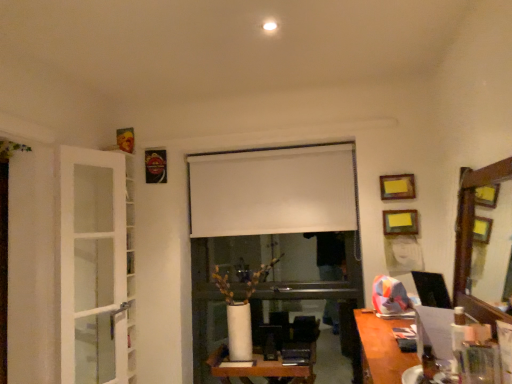
This screenshot has height=384, width=512. What do you see at coordinates (400, 222) in the screenshot?
I see `yellow paper at upper right, arranged as the first picture frame when ordered from the bottom` at bounding box center [400, 222].

The image size is (512, 384). What do you see at coordinates (397, 187) in the screenshot?
I see `wooden picture frame at upper right, the 2th picture frame when ordered from right to left` at bounding box center [397, 187].

This screenshot has height=384, width=512. Describe the element at coordinates (155, 166) in the screenshot. I see `metallic gold picture frame at upper left, the third picture frame from the bottom` at that location.

Measure the distance between point (x=479, y=308) and camera.

Point (x=479, y=308) and camera are 1.79 meters apart from each other.

Where is `yellow paper at upper right, which appears as the 3th picture frame when viewed from the left`? Image resolution: width=512 pixels, height=384 pixels. yellow paper at upper right, which appears as the 3th picture frame when viewed from the left is located at coordinates (400, 222).

Between white glossy table at center, the 1th table viewed from the back, and metallic gold picture frame at upper left, acting as the first picture frame starting from the left, which one appears on the right side from the viewer's perspective?

From the viewer's perspective, white glossy table at center, the 1th table viewed from the back, appears more on the right side.

From the picture: Is white glossy table at center, the second table from the top, in contact with metallic gold picture frame at upper left, which is counted as the third picture frame, starting from the front?

There is a gap between white glossy table at center, the second table from the top, and metallic gold picture frame at upper left, which is counted as the third picture frame, starting from the front.

Is white glossy table at center, placed as the first table when sorted from left to right, oriented towards metallic gold picture frame at upper left, the third picture frame from the bottom?

No, white glossy table at center, placed as the first table when sorted from left to right, is not facing towards metallic gold picture frame at upper left, the third picture frame from the bottom.

Is point (287, 377) closer or farther from the camera than point (152, 178)?

Point (287, 377) appears to be closer to the viewer than point (152, 178).

Considering the relative sizes of wooden framed mirror at right and metallic gold picture frame at upper left, placed as the first picture frame when sorted from top to bottom, in the image provided, is wooden framed mirror at right wider than metallic gold picture frame at upper left, placed as the first picture frame when sorted from top to bottom,?

Yes, wooden framed mirror at right is wider than metallic gold picture frame at upper left, placed as the first picture frame when sorted from top to bottom.

Is wooden framed mirror at right far away from metallic gold picture frame at upper left, acting as the first picture frame starting from the left?

Yes, wooden framed mirror at right and metallic gold picture frame at upper left, acting as the first picture frame starting from the left, are quite far apart.

Is wooden framed mirror at right looking in the opposite direction of metallic gold picture frame at upper left, the third picture frame from the right?

No, wooden framed mirror at right is not facing the opposite direction of metallic gold picture frame at upper left, the third picture frame from the right.

Considering the sizes of objects wooden framed mirror at right and metallic gold picture frame at upper left, the third picture frame from the bottom, in the image provided, who is bigger, wooden framed mirror at right or metallic gold picture frame at upper left, the third picture frame from the bottom,?

With larger size is wooden framed mirror at right.

Can we say wooden picture frame at upper right, which is the 2th picture frame from back to front, lies outside white glossy table at center, the 2th table in the front-to-back sequence?

Yes, wooden picture frame at upper right, which is the 2th picture frame from back to front, is not within white glossy table at center, the 2th table in the front-to-back sequence.

From a real-world perspective, between wooden picture frame at upper right, the 2th picture frame in the bottom-to-top sequence, and white glossy table at center, the first table in the bottom-to-top sequence, who is vertically higher?

wooden picture frame at upper right, the 2th picture frame in the bottom-to-top sequence, from a real-world perspective.

Which is behind, wooden picture frame at upper right, which ranks as the second picture frame in front-to-back order, or white glossy table at center, the first table in the bottom-to-top sequence?

wooden picture frame at upper right, which ranks as the second picture frame in front-to-back order, is further away from the camera.

How different are the orientations of wooden picture frame at upper right, which ranks as the second picture frame in front-to-back order, and white glossy table at center, placed as the first table when sorted from left to right, in degrees?

There is a 3.54-degree angle between the facing directions of wooden picture frame at upper right, which ranks as the second picture frame in front-to-back order, and white glossy table at center, placed as the first table when sorted from left to right.

Is there a large distance between metallic gold picture frame at upper left, acting as the first picture frame starting from the left, and wooden picture frame at upper right, which ranks as the second picture frame in left-to-right order?

Yes, metallic gold picture frame at upper left, acting as the first picture frame starting from the left, and wooden picture frame at upper right, which ranks as the second picture frame in left-to-right order, are quite far apart.

Is metallic gold picture frame at upper left, placed as the first picture frame when sorted from top to bottom, bigger or smaller than wooden picture frame at upper right, the 2th picture frame when ordered from right to left?

Clearly, metallic gold picture frame at upper left, placed as the first picture frame when sorted from top to bottom, is larger in size than wooden picture frame at upper right, the 2th picture frame when ordered from right to left.

From the picture: Considering the sizes of objects metallic gold picture frame at upper left, the third picture frame from the bottom, and wooden picture frame at upper right, which is the 2th picture frame from back to front, in the image provided, who is thinner, metallic gold picture frame at upper left, the third picture frame from the bottom, or wooden picture frame at upper right, which is the 2th picture frame from back to front,?

wooden picture frame at upper right, which is the 2th picture frame from back to front, is thinner.

Is metallic gold picture frame at upper left, acting as the first picture frame starting from the left, to the right of wooden picture frame at upper right, the 2th picture frame when ordered from right to left, from the viewer's perspective?

Incorrect, metallic gold picture frame at upper left, acting as the first picture frame starting from the left, is not on the right side of wooden picture frame at upper right, the 2th picture frame when ordered from right to left.

In terms of width, does white matte window screen at center look wider or thinner when compared to wooden framed mirror at right?

In the image, white matte window screen at center appears to be more narrow than wooden framed mirror at right.

From the image's perspective, relative to wooden framed mirror at right, is white matte window screen at center above or below?

Based on their image positions, white matte window screen at center is located above wooden framed mirror at right.

From a real-world perspective, is white matte window screen at center located beneath wooden framed mirror at right?

No.

Between white matte window screen at center and wooden framed mirror at right, which one has more height?

wooden framed mirror at right.

Based on the photo, considering the positions of objects wooden picture frame at upper right, the second picture frame in the top-to-bottom sequence, and white glass door at left in the image provided, who is more to the left, wooden picture frame at upper right, the second picture frame in the top-to-bottom sequence, or white glass door at left?

white glass door at left.

From a real-world perspective, which is physically above, wooden picture frame at upper right, the 2th picture frame in the bottom-to-top sequence, or white glass door at left?

In real-world perspective, wooden picture frame at upper right, the 2th picture frame in the bottom-to-top sequence, is above.

Is wooden picture frame at upper right, the 2th picture frame in the bottom-to-top sequence, oriented towards white glass door at left?

No, wooden picture frame at upper right, the 2th picture frame in the bottom-to-top sequence, is not aimed at white glass door at left.

Can you tell me how much wooden picture frame at upper right, the 2th picture frame when ordered from right to left, and white glass door at left differ in facing direction?

wooden picture frame at upper right, the 2th picture frame when ordered from right to left, and white glass door at left are facing 68.2 degrees away from each other.

Which is more to the right, wooden framed mirror at right or wooden desk at lower right, arranged as the 2th table when ordered from the bottom?

wooden framed mirror at right.

Is wooden framed mirror at right bigger or smaller than wooden desk at lower right, the 1th table viewed from the top?

Clearly, wooden framed mirror at right is smaller in size than wooden desk at lower right, the 1th table viewed from the top.

From a real-world perspective, between wooden framed mirror at right and wooden desk at lower right, which is the 2th table from back to front, who is vertically higher?

wooden framed mirror at right, from a real-world perspective.

Can you confirm if wooden framed mirror at right is shorter than wooden desk at lower right, which appears as the 1th table when viewed from the front?

No.

From the metallic gold picture frame at upper left, placed as the first picture frame when sorted from top to bottom, count 1st tables forward and point to it. Please provide its 2D coordinates.

[(261, 368)]

This screenshot has width=512, height=384. Identify the location of mirror below the metallic gold picture frame at upper left, the third picture frame from the bottom (from a real-world perspective). (472, 237).

Based on their spatial positions, is white matte window screen at center or wooden picture frame at upper right, which is the 2th picture frame from back to front, further from metallic gold picture frame at upper left, the third picture frame from the bottom?

wooden picture frame at upper right, which is the 2th picture frame from back to front, is further to metallic gold picture frame at upper left, the third picture frame from the bottom.

Which object lies nearer to the anchor point white glossy table at center, the first table in the bottom-to-top sequence, yellow paper at upper right, arranged as the first picture frame when ordered from the bottom, or white matte window screen at center?

white matte window screen at center lies closer to white glossy table at center, the first table in the bottom-to-top sequence, than the other object.

Considering their positions, is wooden picture frame at upper right, which is the 2th picture frame from back to front, positioned closer to white matte window screen at center than yellow paper at upper right, arranged as the first picture frame when ordered from the bottom?

wooden picture frame at upper right, which is the 2th picture frame from back to front, is positioned closer to the anchor white matte window screen at center.

When comparing their distances from white glossy table at center, the 1th table viewed from the back, does wooden framed mirror at right or white matte window screen at center seem further?

wooden framed mirror at right is positioned further to the anchor white glossy table at center, the 1th table viewed from the back.

Considering their positions, is metallic gold picture frame at upper left, placed as the first picture frame when sorted from top to bottom, positioned closer to yellow paper at upper right, arranged as the first picture frame when ordered from the bottom, than white glass door at left?

Among the two, metallic gold picture frame at upper left, placed as the first picture frame when sorted from top to bottom, is located nearer to yellow paper at upper right, arranged as the first picture frame when ordered from the bottom.

Looking at this image, from the image, which object appears to be farther from white matte window screen at center, white glass door at left or wooden framed mirror at right?

The object further to white matte window screen at center is wooden framed mirror at right.

Which object lies further to the anchor point wooden framed mirror at right, yellow paper at upper right, the first picture frame from the front, or wooden picture frame at upper right, the 2th picture frame when ordered from right to left?

wooden picture frame at upper right, the 2th picture frame when ordered from right to left.

When comparing their distances from white matte window screen at center, does white glossy table at center, placed as the first table when sorted from left to right, or metallic gold picture frame at upper left, the third picture frame from the right, seem further?

white glossy table at center, placed as the first table when sorted from left to right, is further to white matte window screen at center.

You are a GUI agent. You are given a task and a screenshot of the screen. Output one action in this format:
    pyautogui.click(x=<x>, y=<y>)
    Task: Click on the mirror positioned between wooden desk at lower right, which appears as the 1th table when viewed from the front, and yellow paper at upper right, which appears as the 3th picture frame when viewed from the left, from near to far
    
    Given the screenshot: What is the action you would take?
    pyautogui.click(x=472, y=237)

This screenshot has width=512, height=384. What are the coordinates of `window screen between wooden framed mirror at right and metallic gold picture frame at upper left, the third picture frame from the bottom, from front to back` in the screenshot? It's located at (272, 191).

Find the location of a particular element. The width and height of the screenshot is (512, 384). window screen between white glass door at left and wooden framed mirror at right in the horizontal direction is located at coordinates (272, 191).

You are a GUI agent. You are given a task and a screenshot of the screen. Output one action in this format:
    pyautogui.click(x=<x>, y=<y>)
    Task: Click on the window screen between metallic gold picture frame at upper left, which is counted as the third picture frame, starting from the front, and white glossy table at center, the 2th table in the front-to-back sequence, in the vertical direction
    The width and height of the screenshot is (512, 384).
    Given the screenshot: What is the action you would take?
    pyautogui.click(x=272, y=191)